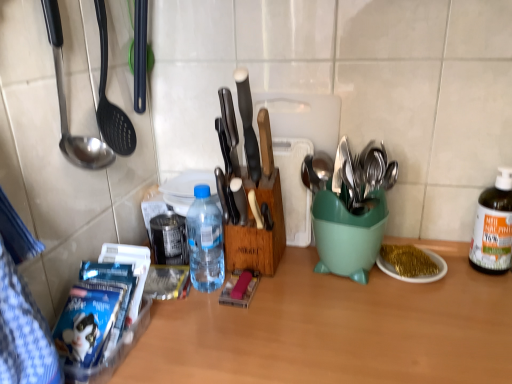
Question: Is white plastic cutting board at center further to the viewer compared to gold glitter plate at right?

Choices:
 (A) no
 (B) yes

Answer: (B)

Question: Is white plastic cutting board at center outside gold glitter plate at right?

Choices:
 (A) yes
 (B) no

Answer: (A)

Question: Is white plastic cutting board at center closer to the viewer compared to gold glitter plate at right?

Choices:
 (A) yes
 (B) no

Answer: (B)

Question: From the image's perspective, is white plastic cutting board at center beneath gold glitter plate at right?

Choices:
 (A) yes
 (B) no

Answer: (B)

Question: Considering the relative sizes of white plastic cutting board at center and gold glitter plate at right in the image provided, is white plastic cutting board at center wider than gold glitter plate at right?

Choices:
 (A) no
 (B) yes

Answer: (A)

Question: Can you see white plastic cutting board at center touching gold glitter plate at right?

Choices:
 (A) yes
 (B) no

Answer: (B)

Question: From a real-world perspective, is white plastic cutting board at center located beneath wooden spoon at center, marked as the 1th spoon in a back-to-front arrangement?

Choices:
 (A) yes
 (B) no

Answer: (B)

Question: Is white plastic cutting board at center at the left side of wooden spoon at center, arranged as the first spoon when ordered from the bottom?

Choices:
 (A) yes
 (B) no

Answer: (B)

Question: Is white plastic cutting board at center shorter than wooden spoon at center, the 2th spoon in the left-to-right sequence?

Choices:
 (A) yes
 (B) no

Answer: (B)

Question: Is white plastic cutting board at center positioned with its back to wooden spoon at center, the second spoon when ordered from front to back?

Choices:
 (A) no
 (B) yes

Answer: (A)

Question: Would you say white plastic cutting board at center contains wooden spoon at center, which is counted as the 1th spoon, starting from the right?

Choices:
 (A) yes
 (B) no

Answer: (B)

Question: Is white plastic cutting board at center positioned in front of wooden spoon at center, the second spoon when ordered from front to back?

Choices:
 (A) no
 (B) yes

Answer: (A)

Question: Is translucent plastic bottle at center, the first bottle from the left, to the right of white plastic knife at center from the viewer's perspective?

Choices:
 (A) no
 (B) yes

Answer: (A)